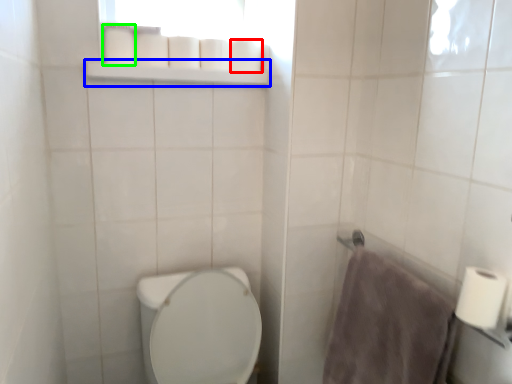
Question: Considering the real-world distances, which object is farthest from toilet paper (highlighted by a red box)? balustrade (highlighted by a blue box) or toilet paper (highlighted by a green box)?

Choices:
 (A) balustrade
 (B) toilet paper

Answer: (B)